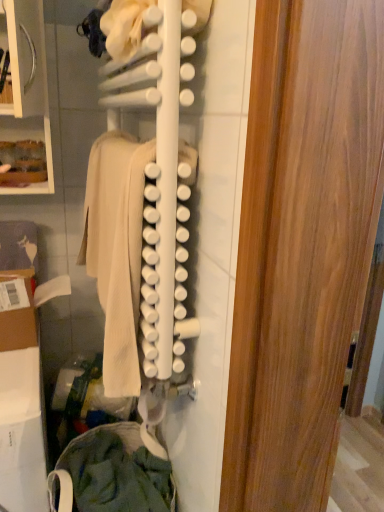
From the picture: Measure the distance between white matte rack at center and camera.

A distance of 25.75 inches exists between white matte rack at center and camera.

Where is `green cotton pants at lower left, the first clothing ordered from the bottom`? The image size is (384, 512). green cotton pants at lower left, the first clothing ordered from the bottom is located at coordinates [x=115, y=472].

Does point (136, 272) appear closer or farther from the camera than point (112, 146)?

Clearly, point (136, 272) is closer to the camera than point (112, 146).

Is white matte rack at center next to beige wool sweater at center, the 1th clothing positioned from the top, and touching it?

Absolutely, white matte rack at center is next to and touching beige wool sweater at center, the 1th clothing positioned from the top.

You are a GUI agent. You are given a task and a screenshot of the screen. Output one action in this format:
    pyautogui.click(x=<x>, y=<y>)
    Task: Click on the 1st clothing behind the white matte rack at center
    
    Given the screenshot: What is the action you would take?
    pyautogui.click(x=117, y=250)

What's the angular difference between white matte rack at center and beige wool sweater at center, which ranks as the second clothing in bottom-to-top order,'s facing directions?

1.5 degrees.

Based on the photo, between green cotton pants at lower left, the second clothing from the top, and white matte rack at center, which one has more height?

With more height is white matte rack at center.

From a real-world perspective, who is located higher, green cotton pants at lower left, the second clothing from the top, or white matte rack at center?

From a 3D spatial view, white matte rack at center is above.

Is green cotton pants at lower left, the first clothing ordered from the bottom, in contact with white matte rack at center?

No, green cotton pants at lower left, the first clothing ordered from the bottom, is not making contact with white matte rack at center.

From their relative heights in the image, would you say beige wool sweater at center, which ranks as the second clothing in bottom-to-top order, is taller or shorter than white matte rack at center?

In the image, beige wool sweater at center, which ranks as the second clothing in bottom-to-top order, appears to be shorter than white matte rack at center.

Is beige wool sweater at center, the 1th clothing positioned from the top, positioned with its back to white matte rack at center?

That's right, beige wool sweater at center, the 1th clothing positioned from the top, is facing away from white matte rack at center.

Is point (123, 246) positioned in front of point (101, 136)?

Yes, point (123, 246) is closer to viewer.

Can you tell me how much white matte rack at center and green cotton pants at lower left, the second clothing from the top, differ in facing direction?

The facing directions of white matte rack at center and green cotton pants at lower left, the second clothing from the top, are 89.9 degrees apart.

Does white matte rack at center touch green cotton pants at lower left, the second clothing from the top?

No, white matte rack at center is not next to green cotton pants at lower left, the second clothing from the top.

Is white matte rack at center not inside green cotton pants at lower left, the first clothing ordered from the bottom?

That's correct, white matte rack at center is outside of green cotton pants at lower left, the first clothing ordered from the bottom.

Can you confirm if beige wool sweater at center, which ranks as the second clothing in bottom-to-top order, is taller than green cotton pants at lower left, the second clothing from the top?

Indeed, beige wool sweater at center, which ranks as the second clothing in bottom-to-top order, has a greater height compared to green cotton pants at lower left, the second clothing from the top.

Between beige wool sweater at center, which ranks as the second clothing in bottom-to-top order, and green cotton pants at lower left, the second clothing from the top, which one is positioned behind?

green cotton pants at lower left, the second clothing from the top, is further from the camera.

From the image's perspective, does beige wool sweater at center, which ranks as the second clothing in bottom-to-top order, appear higher than green cotton pants at lower left, the second clothing from the top?

Correct, beige wool sweater at center, which ranks as the second clothing in bottom-to-top order, appears higher than green cotton pants at lower left, the second clothing from the top, in the image.

From a real-world perspective, is beige wool sweater at center, which ranks as the second clothing in bottom-to-top order, physically located above or below green cotton pants at lower left, the first clothing ordered from the bottom?

beige wool sweater at center, which ranks as the second clothing in bottom-to-top order, is above green cotton pants at lower left, the first clothing ordered from the bottom.

Is green cotton pants at lower left, the first clothing ordered from the bottom, further to camera compared to beige wool sweater at center, the 1th clothing positioned from the top?

Yes.

Who is taller, green cotton pants at lower left, the first clothing ordered from the bottom, or beige wool sweater at center, the 1th clothing positioned from the top?

beige wool sweater at center, the 1th clothing positioned from the top.

Is green cotton pants at lower left, the second clothing from the top, oriented away from beige wool sweater at center, which ranks as the second clothing in bottom-to-top order?

green cotton pants at lower left, the second clothing from the top, does not have its back to beige wool sweater at center, which ranks as the second clothing in bottom-to-top order.

Is point (53, 494) farther from viewer compared to point (131, 381)?

Yes, point (53, 494) is farther from viewer.

I want to click on closet that appears above the beige wool sweater at center, which ranks as the second clothing in bottom-to-top order (from the image's perspective), so click(144, 201).

You are a GUI agent. You are given a task and a screenshot of the screen. Output one action in this format:
    pyautogui.click(x=<x>, y=<y>)
    Task: Click on the closet above the green cotton pants at lower left, the first clothing ordered from the bottom (from a real-world perspective)
    This screenshot has width=384, height=512.
    Given the screenshot: What is the action you would take?
    pyautogui.click(x=144, y=201)

Which object lies further to the anchor point green cotton pants at lower left, the first clothing ordered from the bottom, white matte rack at center or beige wool sweater at center, the 1th clothing positioned from the top?

white matte rack at center lies further to green cotton pants at lower left, the first clothing ordered from the bottom, than the other object.

Looking at the image, which one is located closer to beige wool sweater at center, which ranks as the second clothing in bottom-to-top order, green cotton pants at lower left, the second clothing from the top, or white matte rack at center?

The object closer to beige wool sweater at center, which ranks as the second clothing in bottom-to-top order, is white matte rack at center.

From the image, which object appears to be farther from white matte rack at center, beige wool sweater at center, the 1th clothing positioned from the top, or green cotton pants at lower left, the first clothing ordered from the bottom?

Based on the image, green cotton pants at lower left, the first clothing ordered from the bottom, appears to be further to white matte rack at center.

When comparing their distances from beige wool sweater at center, which ranks as the second clothing in bottom-to-top order, does white matte rack at center or green cotton pants at lower left, the second clothing from the top, seem closer?

The object closer to beige wool sweater at center, which ranks as the second clothing in bottom-to-top order, is white matte rack at center.

Based on the photo, considering their positions, is green cotton pants at lower left, the second clothing from the top, positioned further to white matte rack at center than beige wool sweater at center, the 1th clothing positioned from the top?

green cotton pants at lower left, the second clothing from the top.

Considering their positions, is beige wool sweater at center, the 1th clothing positioned from the top, positioned closer to green cotton pants at lower left, the second clothing from the top, than white matte rack at center?

The object closer to green cotton pants at lower left, the second clothing from the top, is beige wool sweater at center, the 1th clothing positioned from the top.

At what (x,y) coordinates should I click in order to perform the action: click on clothing between white matte rack at center and green cotton pants at lower left, the second clothing from the top, in the up-down direction. Please return your answer as a coordinate pair (x, y). Looking at the image, I should click on (117, 250).